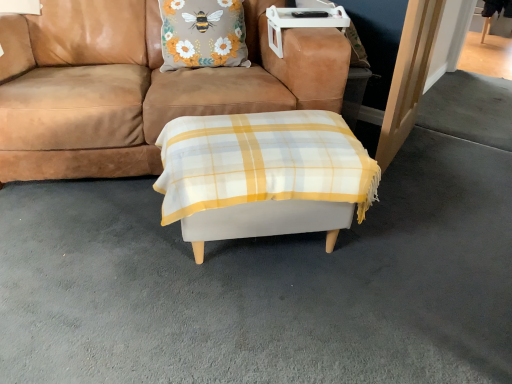
Locate an element on the screen. free space in front of brown suede couch at center is located at coordinates (x=156, y=283).